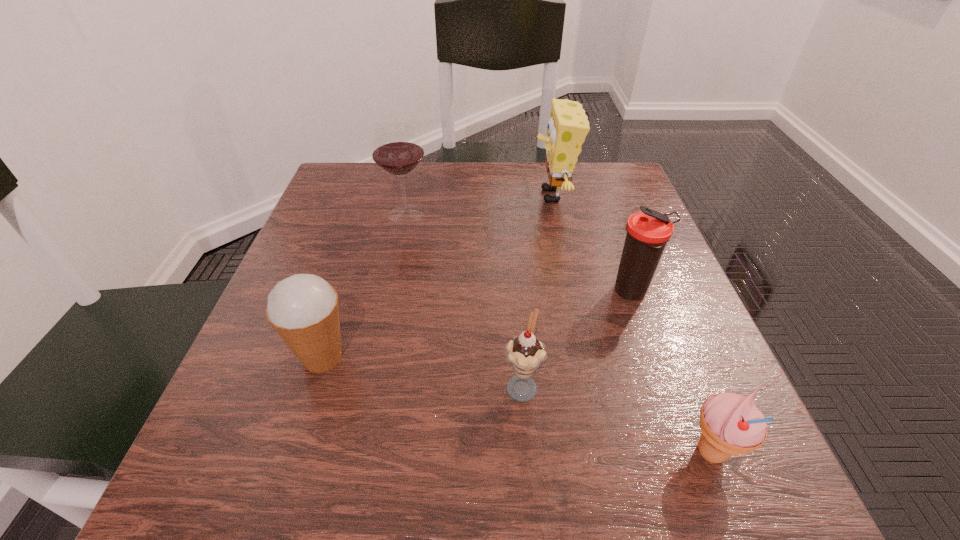
Where is `the fourth object from left to right`? the fourth object from left to right is located at coordinates (567, 128).

The height and width of the screenshot is (540, 960). What are the coordinates of `wineglass` in the screenshot? It's located at (397, 149).

I want to click on thermos bottle, so click(x=648, y=232).

The width and height of the screenshot is (960, 540). I want to click on the leftmost icecream, so click(303, 309).

What are the coordinates of `the second icecream from right to left` in the screenshot? It's located at (525, 353).

The height and width of the screenshot is (540, 960). I want to click on the nearest object, so click(731, 424).

Identify the location of the nearest icecream. The height and width of the screenshot is (540, 960). (731, 424).

You are a GUI agent. You are given a task and a screenshot of the screen. Output one action in this format:
    pyautogui.click(x=<x>, y=<y>)
    Task: Click on the blank space located on the face of the sponge
    
    Given the screenshot: What is the action you would take?
    pyautogui.click(x=473, y=195)

I want to click on vacant region located 0.090m on the face of the sponge, so click(x=494, y=195).

Where is `vacant space located on the face of the sponge`? The height and width of the screenshot is (540, 960). vacant space located on the face of the sponge is located at coordinates (432, 195).